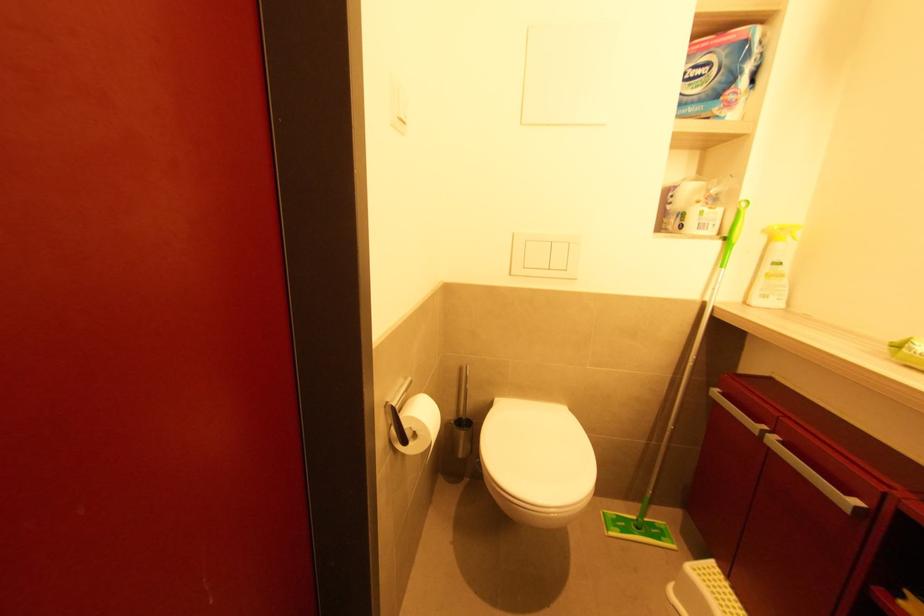
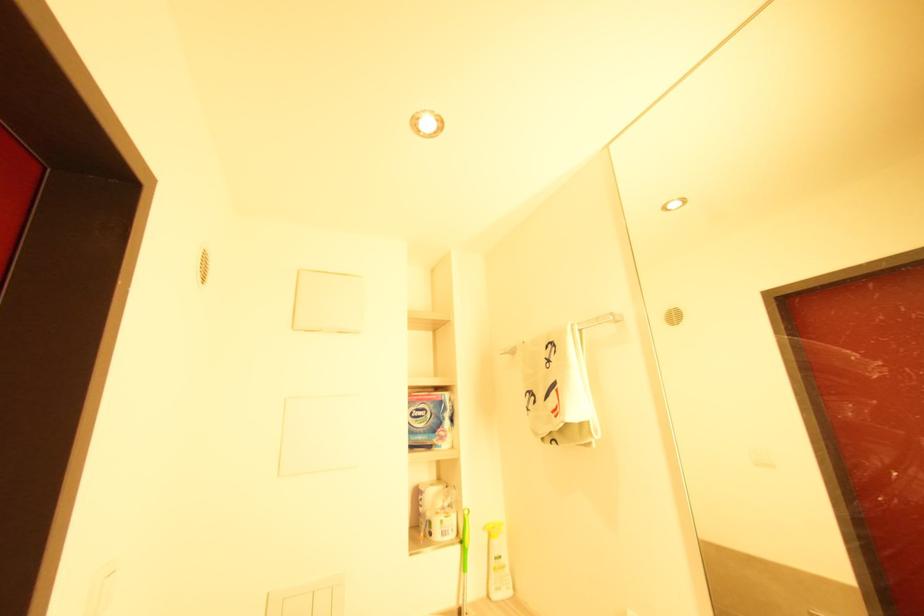
The images are taken continuously from a first-person perspective. In which direction is your viewpoint rotating?

The rotation direction of the camera is right-up.